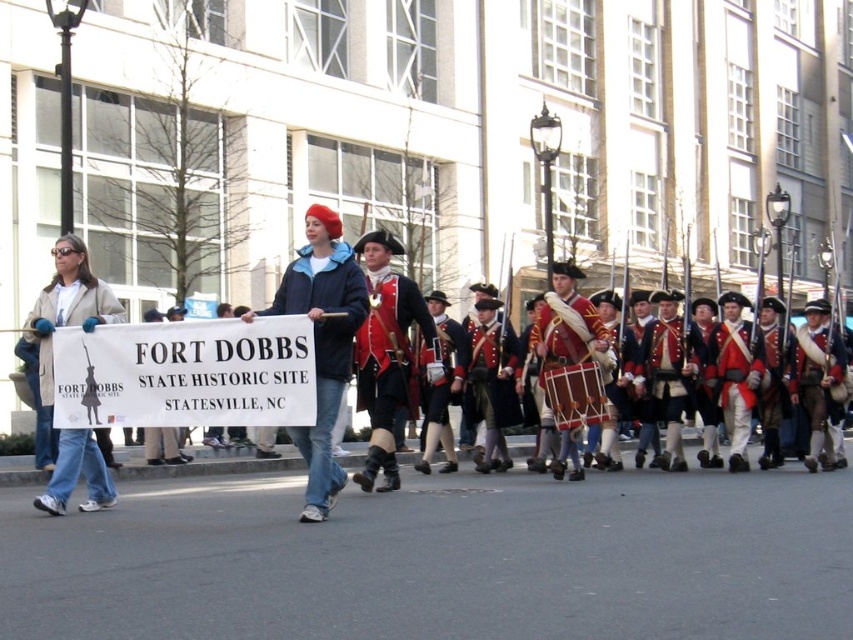
You are a photographer trying to capture a photo of the denim jacket at center and the wooden drum at center. Based on their positions, which object should you focus on first if you want to ensure both are in the frame without moving the camera?

The denim jacket at center is located below the wooden drum at center, so you should focus on the wooden drum at center first to ensure both are in the frame without moving the camera.

You are attending a historical reenactment and see two participants wearing a shiny red coat at center and a denim jacket at left. Which participant is positioned to the right of the other?

The shiny red coat at center is positioned to the right of the denim jacket at left.

You are a photographer standing at the edge of the parade. You want to take a photo that includes both the denim jacket at center and the wooden drum at center without moving your position. Can you fit both into your camera frame if your camera has a maximum horizontal field of view of 3 meters?

The distance between the denim jacket at center and the wooden drum at center is 3.39 meters, which exceeds the camera frame of 3 meters. Therefore, you cannot fit both into the frame without moving your position.